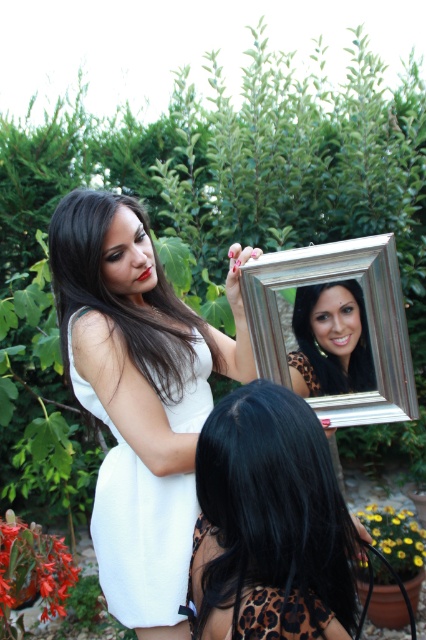
Who is lower down, black leopard print dress at lower center or white cotton dress at center?

black leopard print dress at lower center is lower down.

The image size is (426, 640). What do you see at coordinates (270, 513) in the screenshot?
I see `black leopard print dress at lower center` at bounding box center [270, 513].

Between point (232, 477) and point (138, 563), which one is positioned behind?

The point (138, 563) is behind.

Find the location of a particular element. The width and height of the screenshot is (426, 640). black leopard print dress at lower center is located at coordinates (270, 513).

Is black leopard print dress at lower center shorter than matte black hair at upper center?

Incorrect, black leopard print dress at lower center's height does not fall short of matte black hair at upper center's.

Does black leopard print dress at lower center lie in front of matte black hair at upper center?

Yes, black leopard print dress at lower center is closer to the viewer.

Who is more distant from viewer, (293, 396) or (325, 388)?

Positioned behind is point (325, 388).

Image resolution: width=426 pixels, height=640 pixels. In order to click on black leopard print dress at lower center in this screenshot , I will do `click(270, 513)`.

Is white satin dress at center above matte black hair at upper center?

No, white satin dress at center is not above matte black hair at upper center.

Does point (144, 460) lie in front of point (322, 348)?

Yes.

This screenshot has height=640, width=426. Describe the element at coordinates (140, 396) in the screenshot. I see `white satin dress at center` at that location.

Identify the location of white satin dress at center. (140, 396).